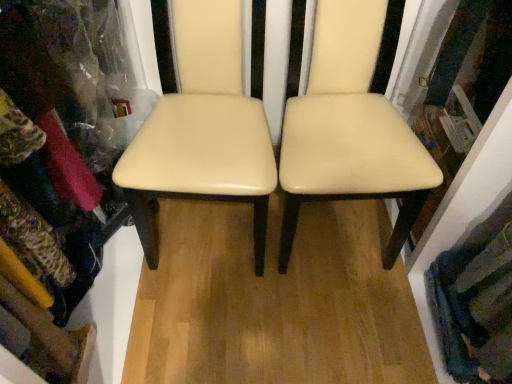
Question: Is creamy leather chair at center, the 1th chair from the right, at the right side of cream leather chair at center, which is counted as the 1th chair, starting from the left?

Choices:
 (A) no
 (B) yes

Answer: (B)

Question: From the image's perspective, is creamy leather chair at center, which ranks as the 2th chair in left-to-right order, located beneath cream leather chair at center, which is counted as the 1th chair, starting from the left?

Choices:
 (A) yes
 (B) no

Answer: (A)

Question: Does creamy leather chair at center, the 1th chair from the right, turn towards cream leather chair at center, placed as the second chair when sorted from right to left?

Choices:
 (A) yes
 (B) no

Answer: (B)

Question: Can you confirm if creamy leather chair at center, which ranks as the 2th chair in left-to-right order, is thinner than cream leather chair at center, which is counted as the 1th chair, starting from the left?

Choices:
 (A) no
 (B) yes

Answer: (A)

Question: Can you confirm if creamy leather chair at center, the 1th chair from the right, is positioned to the left of cream leather chair at center, which is counted as the 1th chair, starting from the left?

Choices:
 (A) no
 (B) yes

Answer: (A)

Question: Considering the positions of cream leather chair at center, which is counted as the 1th chair, starting from the left, and creamy leather chair at center, the 1th chair from the right, in the image, is cream leather chair at center, which is counted as the 1th chair, starting from the left, wider or thinner than creamy leather chair at center, the 1th chair from the right,?

Choices:
 (A) thin
 (B) wide

Answer: (A)

Question: From their relative heights in the image, would you say cream leather chair at center, placed as the second chair when sorted from right to left, is taller or shorter than creamy leather chair at center, which ranks as the 2th chair in left-to-right order?

Choices:
 (A) short
 (B) tall

Answer: (A)

Question: From a real-world perspective, is cream leather chair at center, which is counted as the 1th chair, starting from the left, physically located above or below creamy leather chair at center, which ranks as the 2th chair in left-to-right order?

Choices:
 (A) below
 (B) above

Answer: (A)

Question: In the image, is cream leather chair at center, which is counted as the 1th chair, starting from the left, on the left side or the right side of creamy leather chair at center, which ranks as the 2th chair in left-to-right order?

Choices:
 (A) right
 (B) left

Answer: (B)

Question: Is creamy leather chair at center, which ranks as the 2th chair in left-to-right order, wider or thinner than textured wool scarf at lower right?

Choices:
 (A) wide
 (B) thin

Answer: (A)

Question: Relative to textured wool scarf at lower right, is creamy leather chair at center, which ranks as the 2th chair in left-to-right order, in front or behind?

Choices:
 (A) front
 (B) behind

Answer: (A)

Question: Based on their sizes in the image, would you say creamy leather chair at center, the 1th chair from the right, is bigger or smaller than textured wool scarf at lower right?

Choices:
 (A) small
 (B) big

Answer: (B)

Question: Is creamy leather chair at center, the 1th chair from the right, inside the boundaries of textured wool scarf at lower right, or outside?

Choices:
 (A) inside
 (B) outside

Answer: (B)

Question: Is creamy leather chair at center, which ranks as the 2th chair in left-to-right order, bigger or smaller than cream leather chair at center, which is counted as the 1th chair, starting from the left?

Choices:
 (A) big
 (B) small

Answer: (A)

Question: Based on their positions, is creamy leather chair at center, which ranks as the 2th chair in left-to-right order, located to the left or right of cream leather chair at center, which is counted as the 1th chair, starting from the left?

Choices:
 (A) left
 (B) right

Answer: (B)